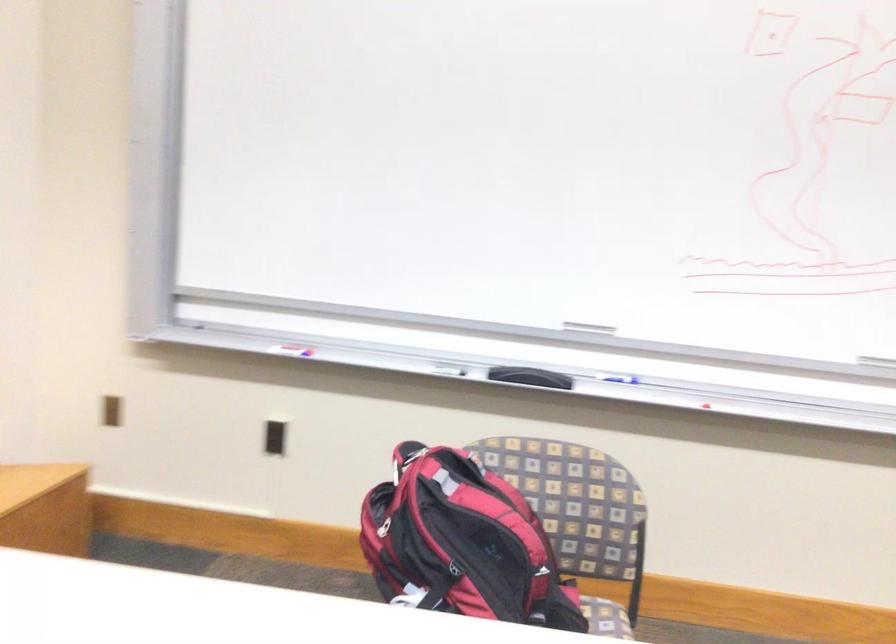
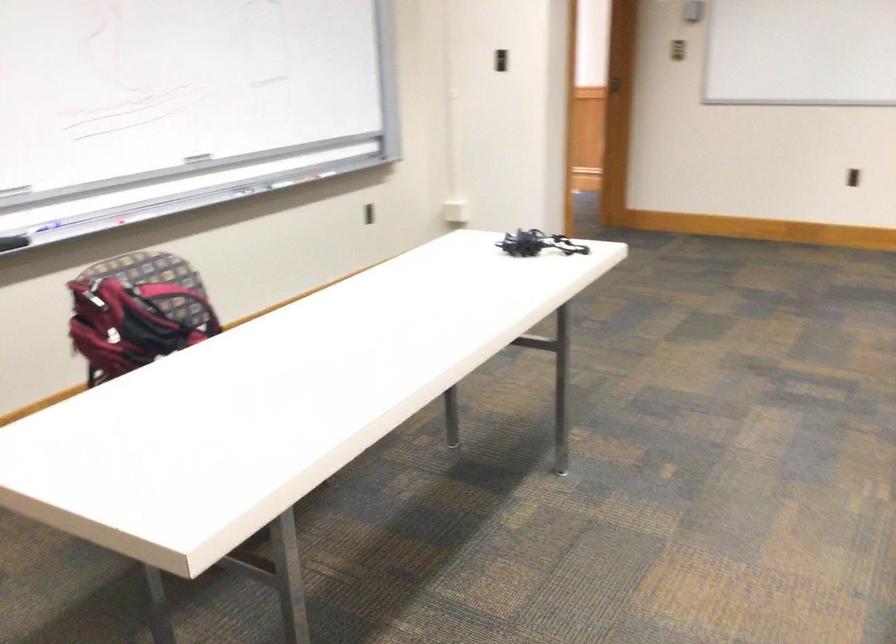
Locate, in the second image, the point that corresponds to [607,381] in the first image.

(39, 229)